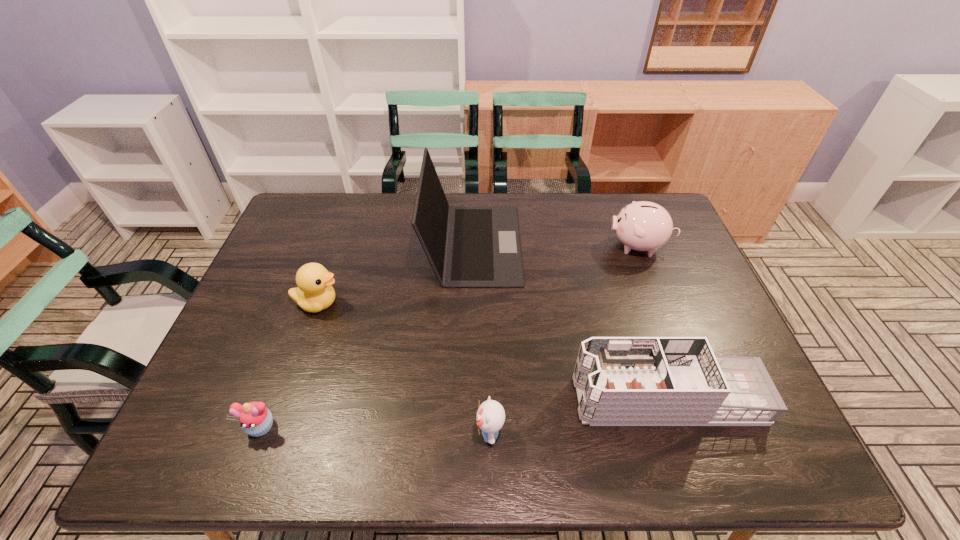
Where is `laptop`? This screenshot has width=960, height=540. laptop is located at coordinates (467, 246).

The height and width of the screenshot is (540, 960). What are the coordinates of `piggy bank` in the screenshot? It's located at (642, 226).

The image size is (960, 540). I want to click on dollhouse, so click(x=620, y=381).

I want to click on the fourth nearest object, so click(314, 293).

Where is `kitten`? Image resolution: width=960 pixels, height=540 pixels. kitten is located at coordinates (490, 417).

Identify the location of cupcake. Image resolution: width=960 pixels, height=540 pixels. (255, 419).

The image size is (960, 540). I want to click on vacant space situated 0.240m on the screen of the tallest object, so click(x=595, y=244).

Where is `vacant space located 0.060m on the back of the piggy bank`? vacant space located 0.060m on the back of the piggy bank is located at coordinates (628, 219).

Where is `vacant region located at the entrance of the dollhouse`? The width and height of the screenshot is (960, 540). vacant region located at the entrance of the dollhouse is located at coordinates (416, 399).

You are a GUI agent. You are given a task and a screenshot of the screen. Output one action in this format:
    pyautogui.click(x=<x>, y=<y>)
    Task: Click on the vacant space located 0.220m at the entrance of the dollhouse
    
    Given the screenshot: What is the action you would take?
    pyautogui.click(x=480, y=399)